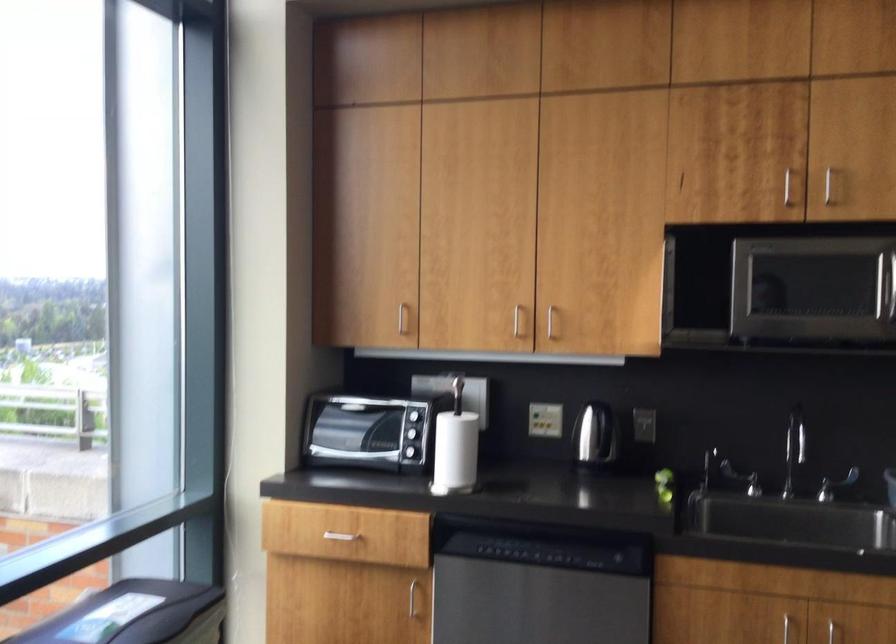
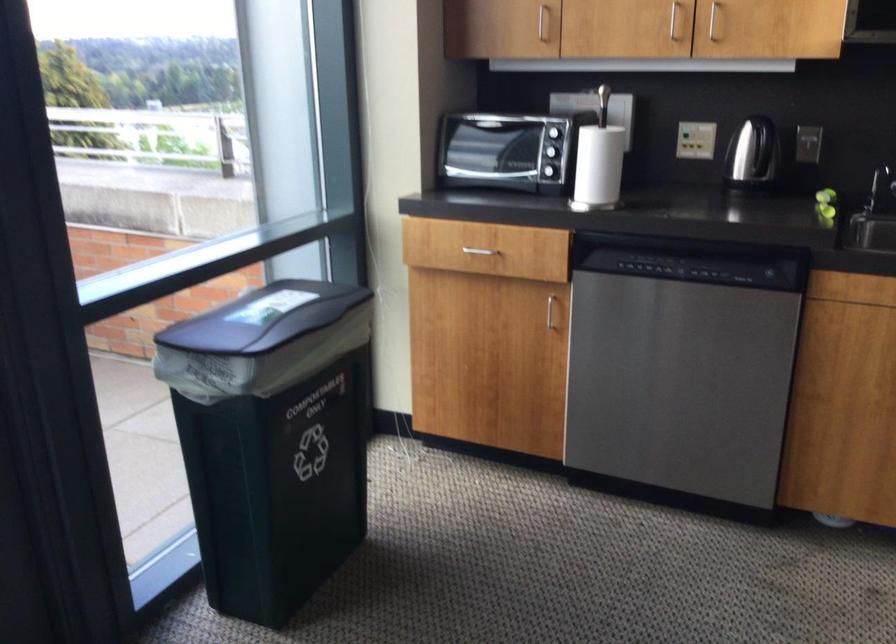
In the second image, find the point that corresponds to [599,442] in the first image.

(752, 152)